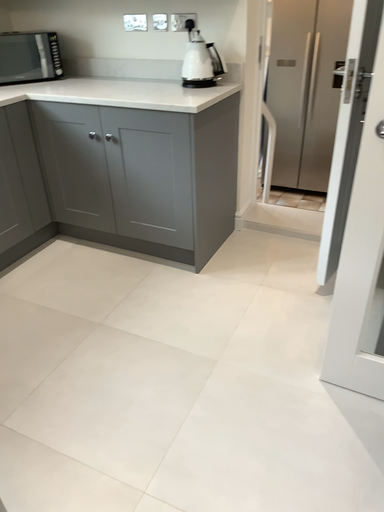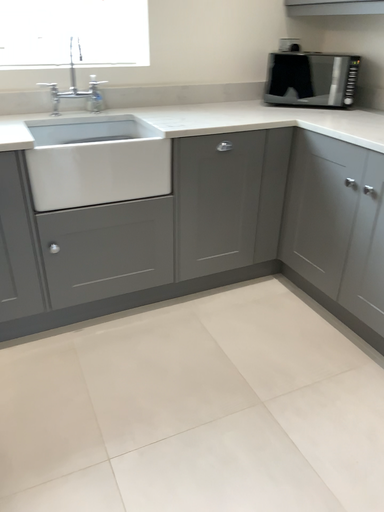
Question: How did the camera likely rotate when shooting the video?

Choices:
 (A) rotated right
 (B) rotated left

Answer: (B)